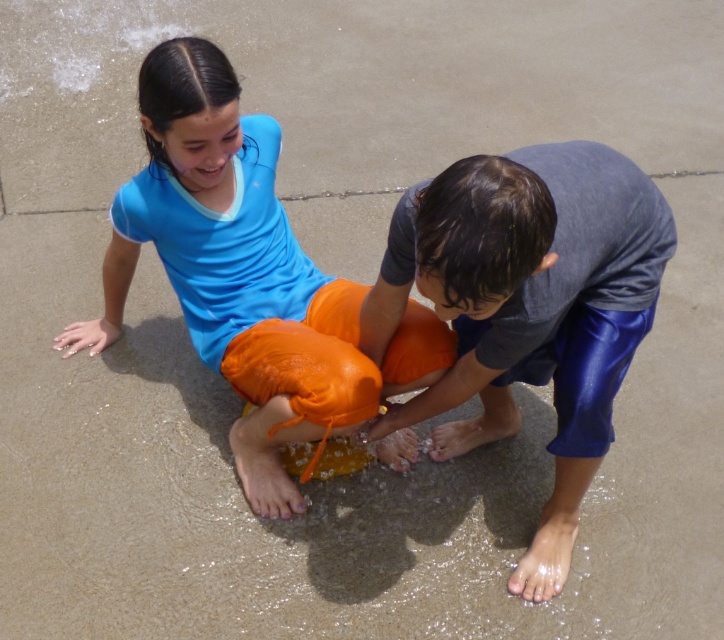
You are a photographer trying to capture a photo of the two children. You want to ensure that both the blue shiny shorts at lower right and the matte blue shirt at upper left are clearly visible. Which object should you focus on first to ensure proper depth of field?

The blue shiny shorts at lower right is shorter than the matte blue shirt at upper left, so you should focus on the matte blue shirt at upper left first since it is farther away and adjusting focus there will help ensure both are in focus.

In the scene shown: You are a photographer trying to capture a photo of the children. You notice a point at coordinates (526, 307) in the image. What object is located at that point?

The point at coordinates (526, 307) corresponds to the blue shiny shorts at lower right.

Consider the image. You are a photographer standing at the center of the scene. You want to capture a photo of the blue shiny shorts at lower right. What is the exact 2D coordinate where you should focus your camera?

The blue shiny shorts at lower right are located at the 2D coordinate point of (526,307).